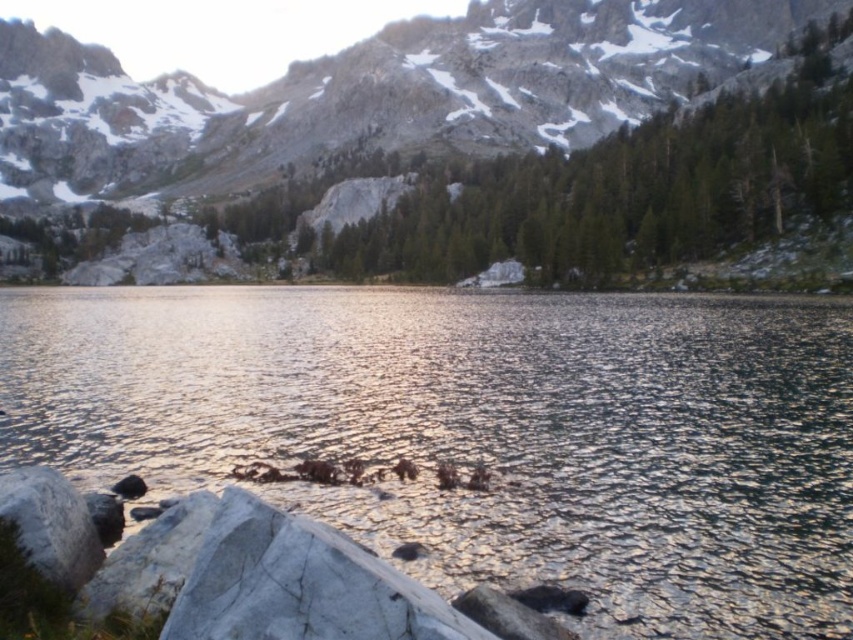
Can you confirm if glistening water at center is smaller than gray rocky mountain at upper center?

Yes.

Can you confirm if glistening water at center is thinner than gray rocky mountain at upper center?

Yes, glistening water at center is thinner than gray rocky mountain at upper center.

Find the location of `glistening water at center`. glistening water at center is located at coordinates (483, 432).

The height and width of the screenshot is (640, 853). I want to click on glistening water at center, so click(483, 432).